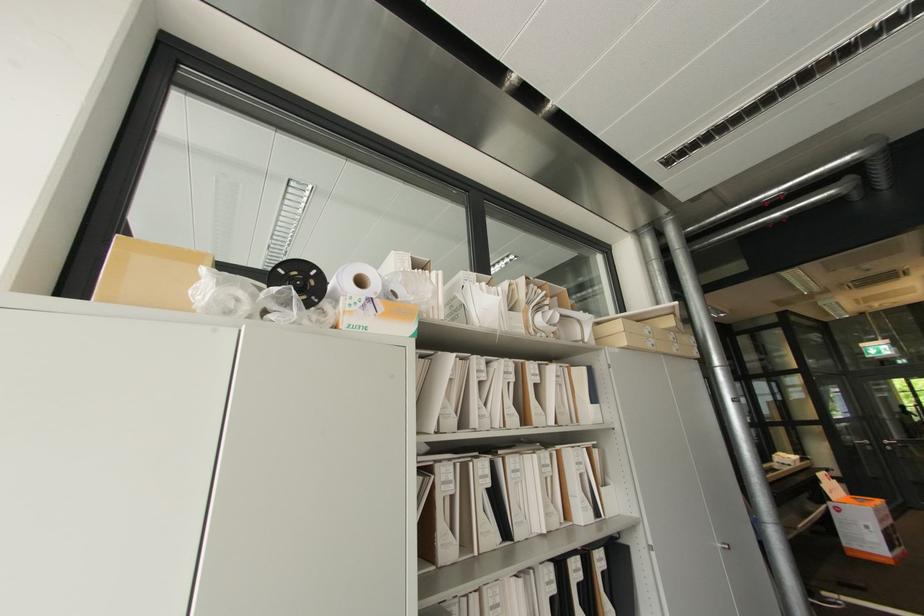
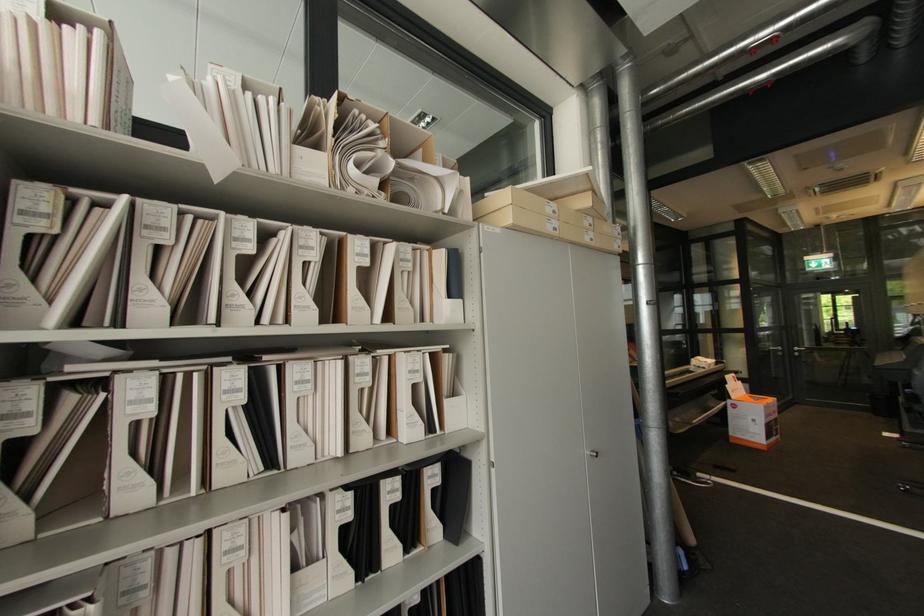
Where in the second image is the point corresponding to (x=893, y=448) from the first image?

(800, 354)